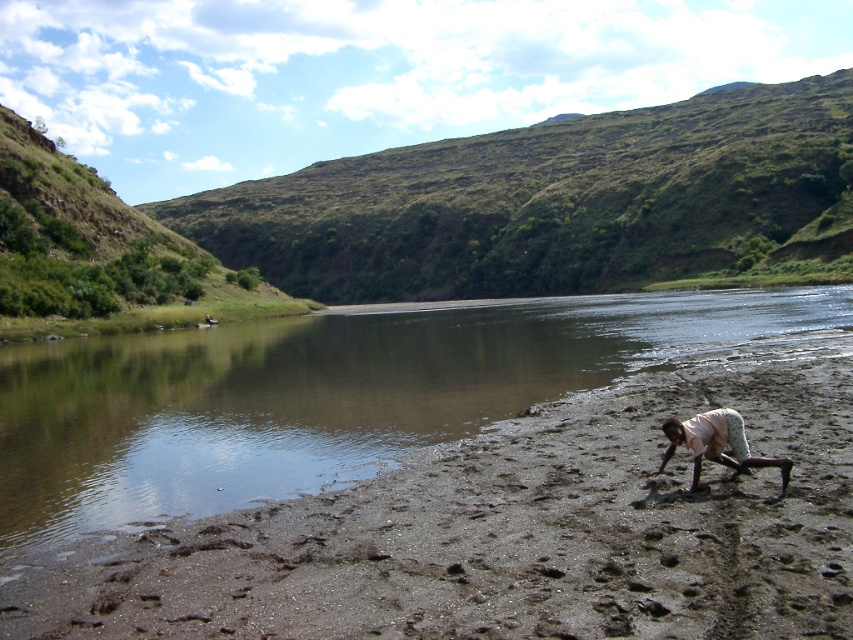
You are standing at the shoreline and want to reach both points marked in the image. Which point, point [521,436] or point [769,461], is closer to you?

Point [521,436] is closer to you because it is further to the camera than point [769,461].

In the scene shown: You are standing on the brown sandy beach at lower right and want to place the light beige fabric squat at lower right on it. Can you determine if the beach is wide enough to accommodate the fabric?

The brown sandy beach at lower right might be wider than light beige fabric squat at lower right, so there is a possibility that the beach is wide enough to accommodate the fabric.

You are standing on the brown sandy beach at lower right and want to reach the light beige fabric squat at lower right. Which direction should you move to get there?

The light beige fabric squat at lower right is above the brown sandy beach at lower right, so you should move upward to reach it.